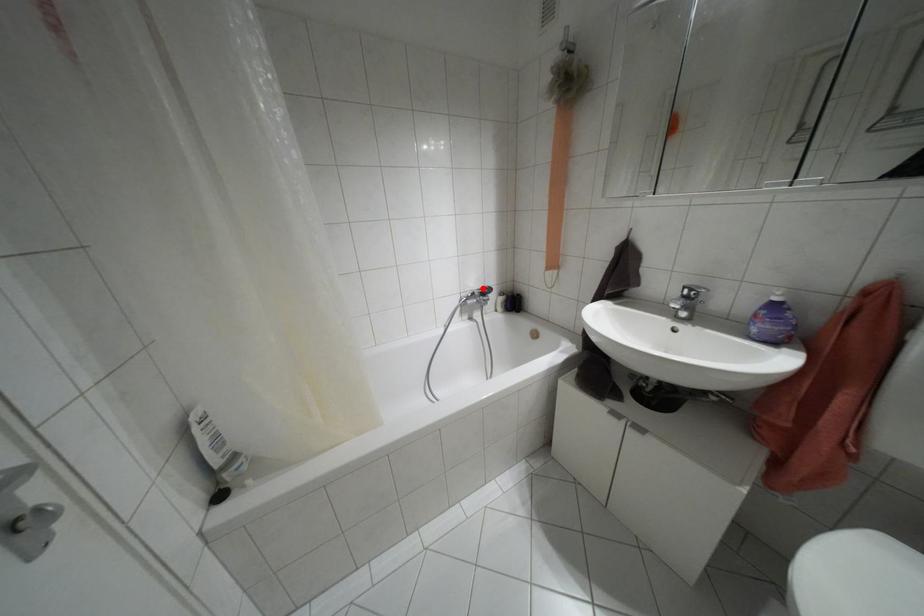
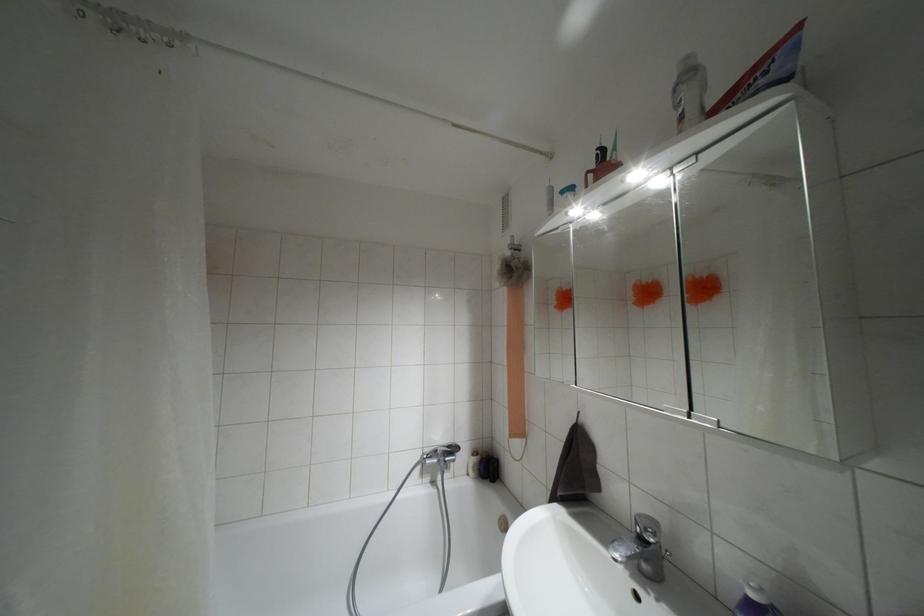
The point at the highlighted location is marked in the first image. Where is the corresponding point in the second image?

(447, 446)